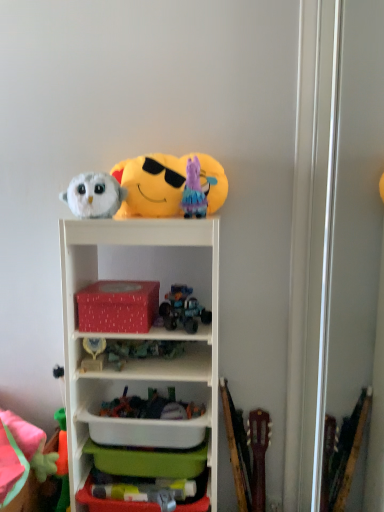
Question: From the image's perspective, is soft plush emoji at upper center, which appears as the 1th toy when viewed from the top, above or below gold metallic trophy at center, which ranks as the 5th toy in top-to-bottom order?

Choices:
 (A) above
 (B) below

Answer: (A)

Question: Is soft plush emoji at upper center, the 7th toy when ordered from bottom to top, bigger or smaller than gold metallic trophy at center, acting as the third toy starting from the bottom?

Choices:
 (A) small
 (B) big

Answer: (B)

Question: Estimate the real-world distances between objects in this image. Which object is closer to the red matte tissue box at center, the 1th storage box positioned from the top?

Choices:
 (A) fluffy white owl at upper left, which is counted as the third toy, starting from the top
 (B) white plastic shelf at center
 (C) fluffy pink plush at lower left, marked as the seventh toy in a top-to-bottom arrangement
 (D) shiny metallic truck at center, marked as the 4th toy in a bottom-to-top arrangement
 (E) white plastic container at center

Answer: (D)

Question: Based on their relative distances, which object is farther from the soft plush emoji at upper center, which appears as the 1th toy when viewed from the top?

Choices:
 (A) shiny metallic truck at center, marked as the 4th toy in a bottom-to-top arrangement
 (B) green plastic storage box at lower center, the first storage box ordered from the bottom
 (C) plush purple at upper center, placed as the second toy when sorted from top to bottom
 (D) fluffy pink plush at lower left, positioned as the first toy in bottom-to-top order
 (E) fluffy white owl at upper left, which is counted as the third toy, starting from the top

Answer: (B)